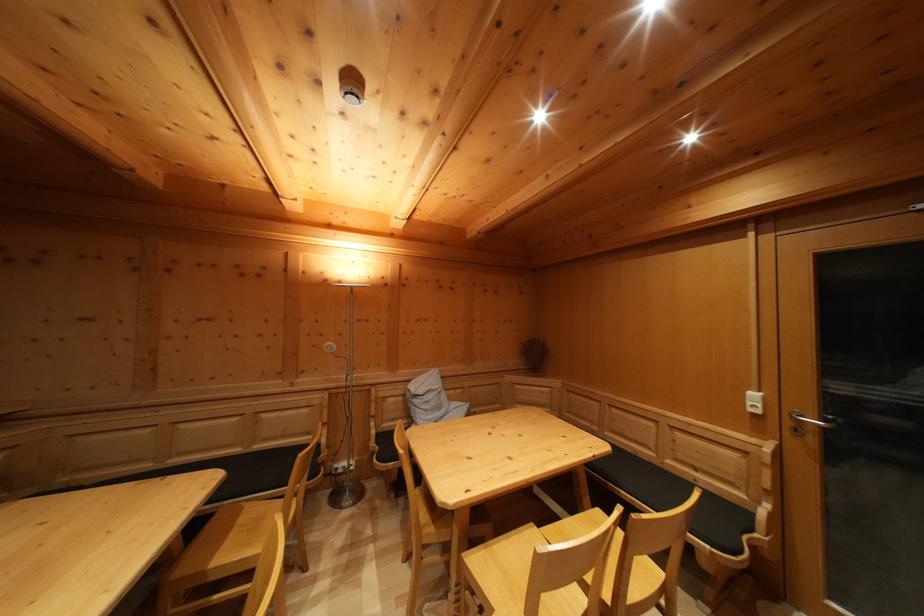
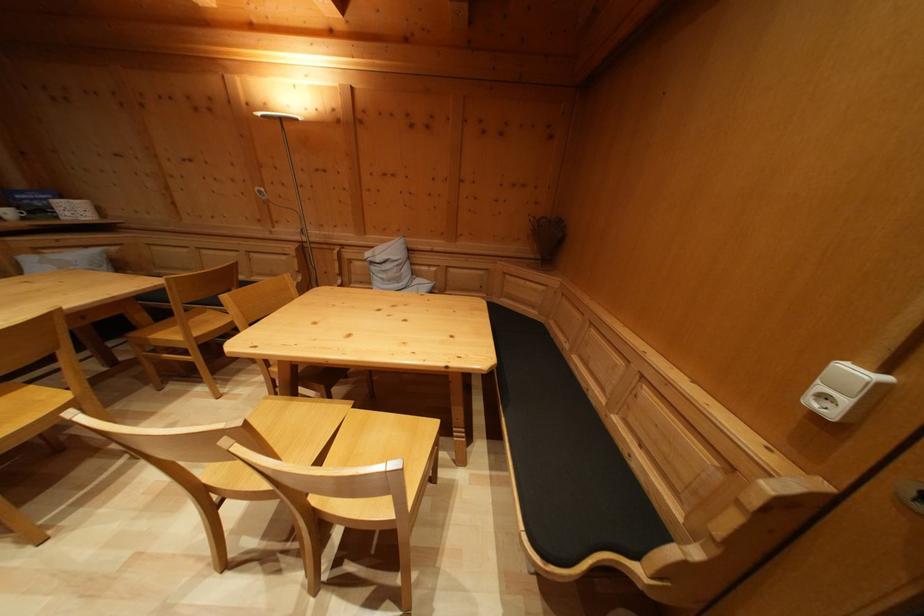
Where in the second image is the point corresponding to pixel 760 402 from the first image?

(859, 379)